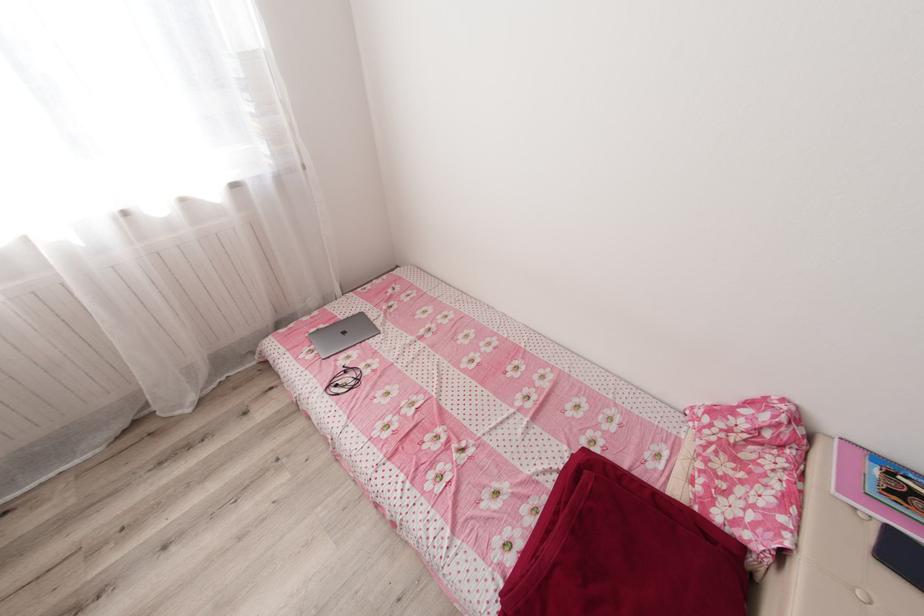
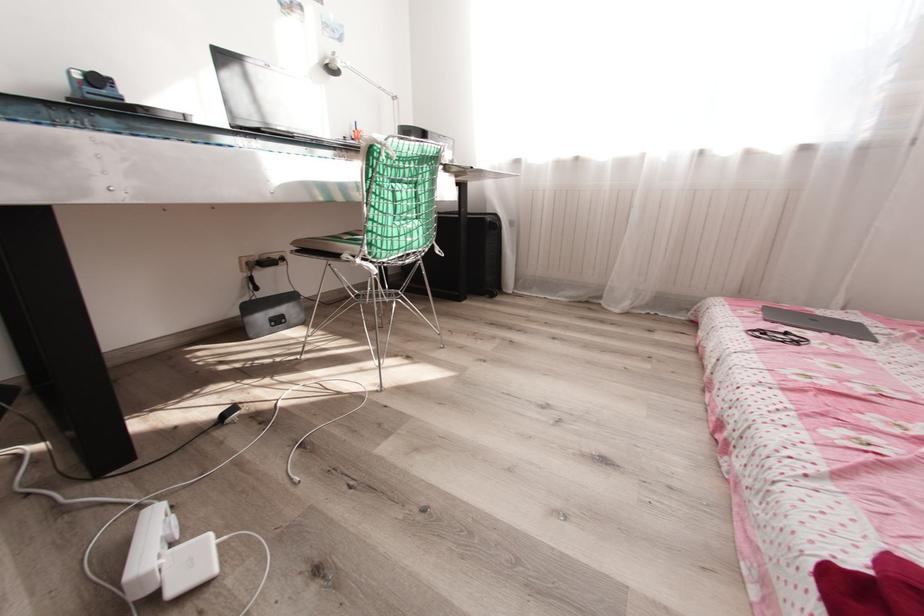
Question: The images are taken continuously from a first-person perspective. In which direction is your viewpoint rotating?

Choices:
 (A) Left
 (B) Right
 (C) Up
 (D) Down

Answer: (A)